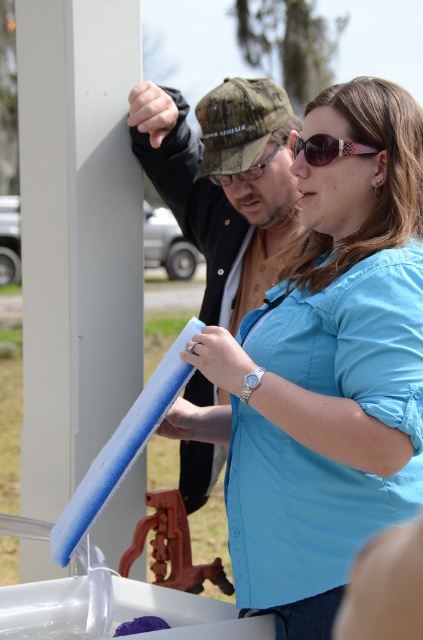
You are standing in the scene and need to reach the blue fabric at center. Which direction should you move relative to the vertical white structure to get there?

The blue fabric at center is located at point (326, 371), so you should move towards the center of the image relative to the vertical white structure to reach it.

You are designing a display case for an art exhibit. The case must accommodate both the matte blue foam at center and the purple shiny sunglasses at center. Given their sizes, which object should be placed on the wider shelf section to ensure proper display?

The matte blue foam at center should be placed on the wider shelf section because its width is larger than the purple shiny sunglasses at center, ensuring it has enough space for proper display.